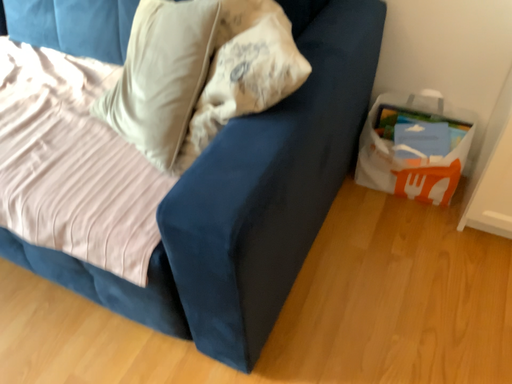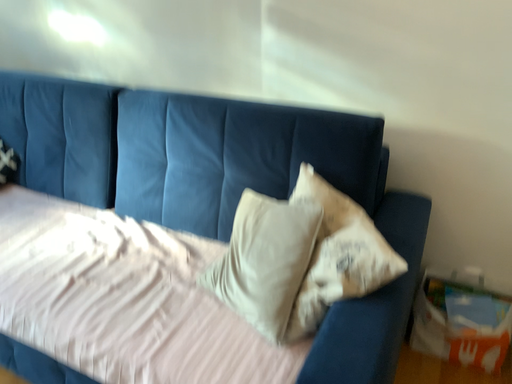
Question: How did the camera likely rotate when shooting the video?

Choices:
 (A) rotated upward
 (B) rotated downward

Answer: (A)